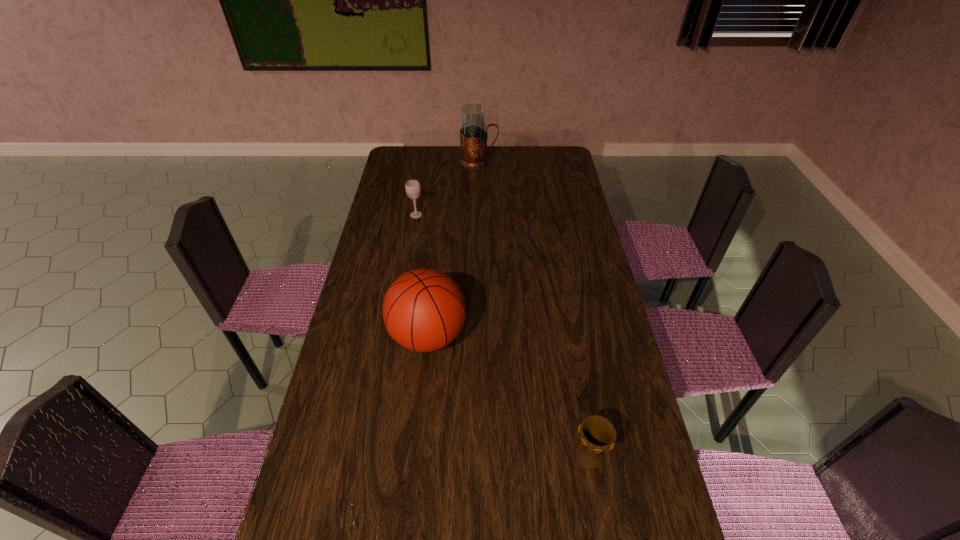
Where is `empty space between the third nearest object and the pitcher`? Image resolution: width=960 pixels, height=540 pixels. empty space between the third nearest object and the pitcher is located at coordinates (447, 188).

Where is `empty location between the nearest object and the wineglass`? Image resolution: width=960 pixels, height=540 pixels. empty location between the nearest object and the wineglass is located at coordinates (x=503, y=335).

Find the location of `vacant region between the wineglass and the pitcher`. vacant region between the wineglass and the pitcher is located at coordinates pyautogui.click(x=447, y=188).

Choose which object is the third nearest neighbor to the nearest object. Please provide its 2D coordinates. Your answer should be formatted as a tuple, i.e. [(x, y)], where the tuple contains the x and y coordinates of a point satisfying the conditions above.

[(473, 133)]

Where is `the third closest object relative to the chalice`? The height and width of the screenshot is (540, 960). the third closest object relative to the chalice is located at coordinates (473, 133).

Find the location of a particular element. The height and width of the screenshot is (540, 960). free region that satisfies the following two spatial constraints: 1. on the back side of the nearest object; 2. with the handle on the side of the pitcher is located at coordinates (538, 161).